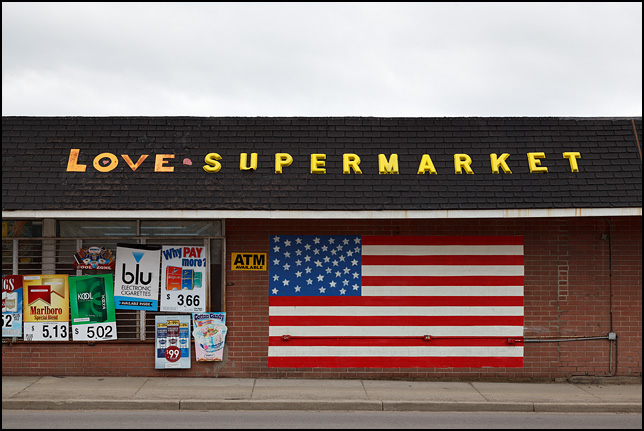
Image resolution: width=644 pixels, height=431 pixels. I want to click on electrical conduit, so click(564, 340).